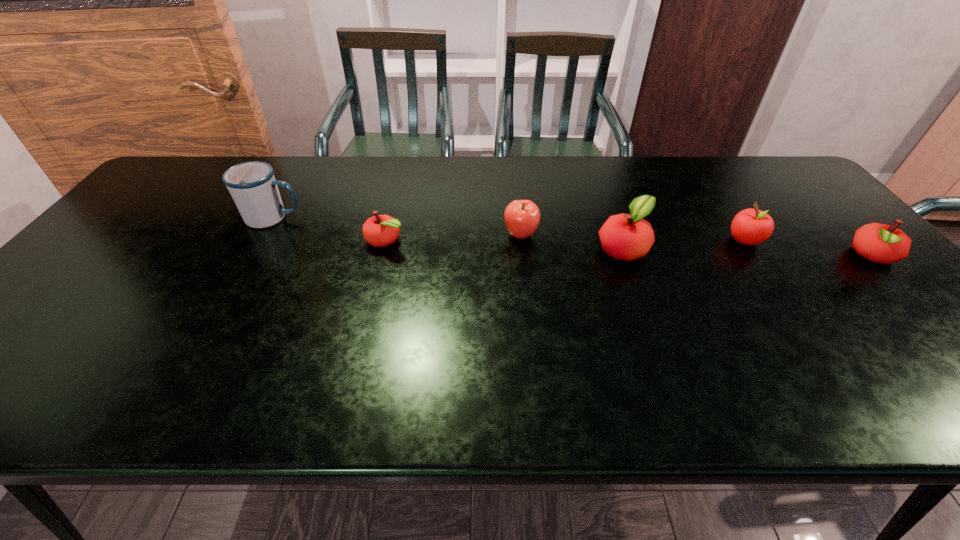
Find the location of `object that is the fifth closest to the second shortest apple`. object that is the fifth closest to the second shortest apple is located at coordinates (252, 185).

Image resolution: width=960 pixels, height=540 pixels. What are the coordinates of `apple that stands as the closest to the second apple from left to right` in the screenshot? It's located at (628, 237).

You are a GUI agent. You are given a task and a screenshot of the screen. Output one action in this format:
    pyautogui.click(x=<x>, y=<y>)
    Task: Click on the apple that is the third closest one to the shortest object
    The image size is (960, 540).
    Given the screenshot: What is the action you would take?
    pyautogui.click(x=750, y=226)

What are the coordinates of `blank space that satisfies the following two spatial constraints: 1. on the handle side of the fifth object from left to right; 2. on the left side of the mug` in the screenshot? It's located at (261, 240).

At what (x,y) coordinates should I click in order to perform the action: click on vacant position in the image that satisfies the following two spatial constraints: 1. on the handle side of the leftmost object; 2. on the left side of the fifth object from left to right. Please return your answer as a coordinate pair (x, y). The width and height of the screenshot is (960, 540). Looking at the image, I should click on (261, 240).

This screenshot has width=960, height=540. I want to click on vacant space that satisfies the following two spatial constraints: 1. on the handle side of the tallest object; 2. on the back side of the third object from right to left, so click(256, 248).

Where is `free space that satisfies the following two spatial constraints: 1. on the handle side of the tallest object; 2. on the left side of the second apple from left to right`? This screenshot has height=540, width=960. free space that satisfies the following two spatial constraints: 1. on the handle side of the tallest object; 2. on the left side of the second apple from left to right is located at coordinates (264, 234).

Find the location of a particular element. The height and width of the screenshot is (540, 960). vacant region that satisfies the following two spatial constraints: 1. on the handle side of the mug; 2. on the back side of the third apple from left to right is located at coordinates (256, 248).

I want to click on free region that satisfies the following two spatial constraints: 1. on the handle side of the mug; 2. on the left side of the fourth tallest apple, so click(252, 255).

This screenshot has width=960, height=540. Identify the location of free spot that satisfies the following two spatial constraints: 1. on the handle side of the mug; 2. on the right side of the fifth object from right to left. (261, 240).